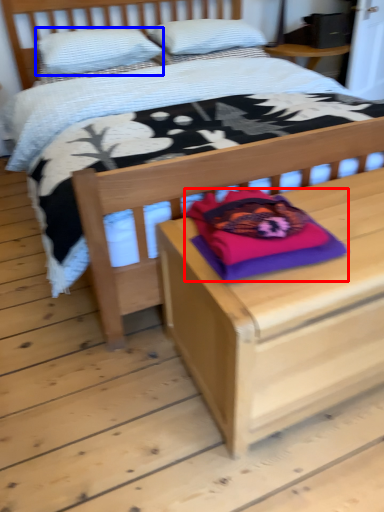
Question: Among these objects, which one is farthest to the camera, pillow (highlighted by a red box) or pillow (highlighted by a blue box)?

Choices:
 (A) pillow
 (B) pillow

Answer: (B)